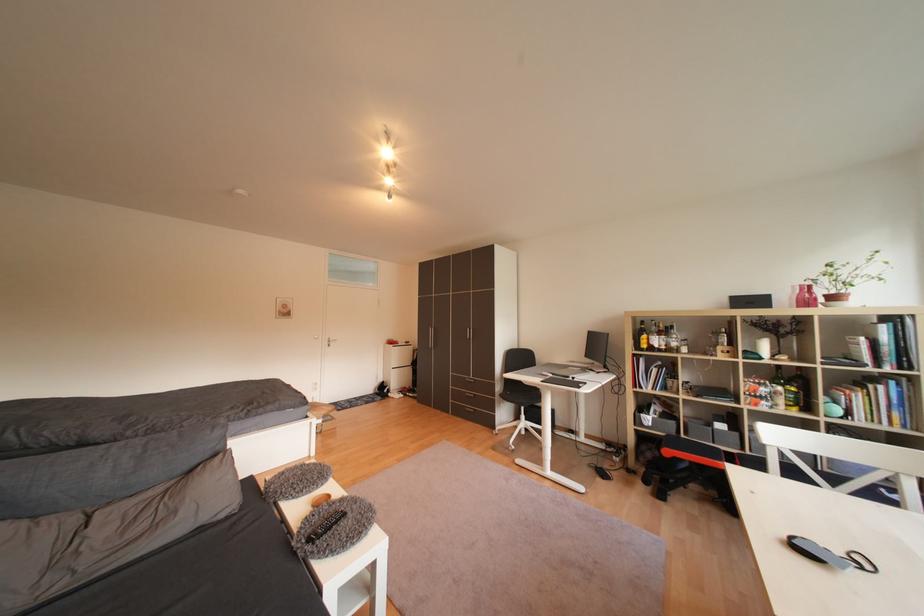
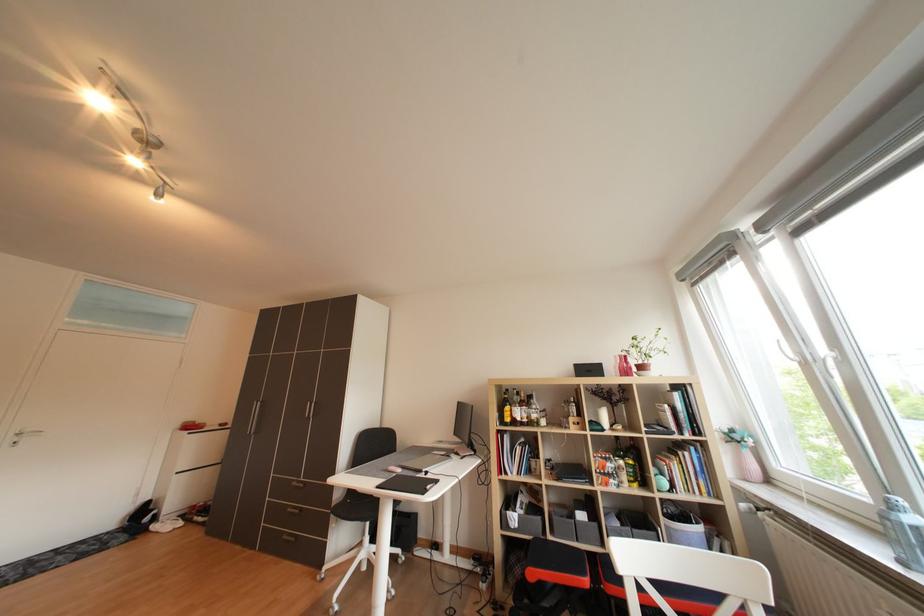
In a continuous first-person perspective shot, in which direction is the camera moving?

The cameraman moved toward right, forward.